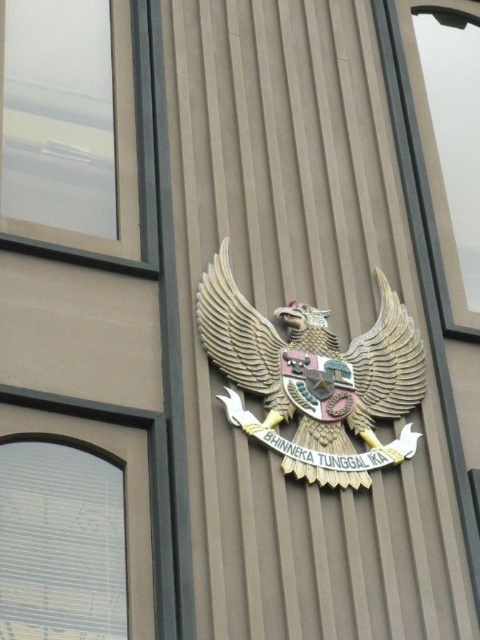
You are standing in front of the building and want to take a photo of the emblem. The two points, point [308,349] and point [382,1], are part of the emblem. Which point will appear larger in your photo?

Point [308,349] is closer to the camera than point [382,1], so it will appear larger in the photo.

You are an architect designing a new building and want to place a decorative item next to the wooden eagle at center. Considering the clear glass window at upper left is already there, which object has a greater width to ensure the decorative item fits properly?

The wooden eagle at center has a greater width than the clear glass window at upper left, so placing the decorative item next to the wooden eagle at center would provide more space.

You are standing in front of the building and want to take a photo of the emblem. You notice two points on the emblem at coordinates point (268, 429) and point (48, 250). Which point will appear larger in your photo?

Point (268, 429) is closer to the camera than point (48, 250), so it will appear larger in the photo.